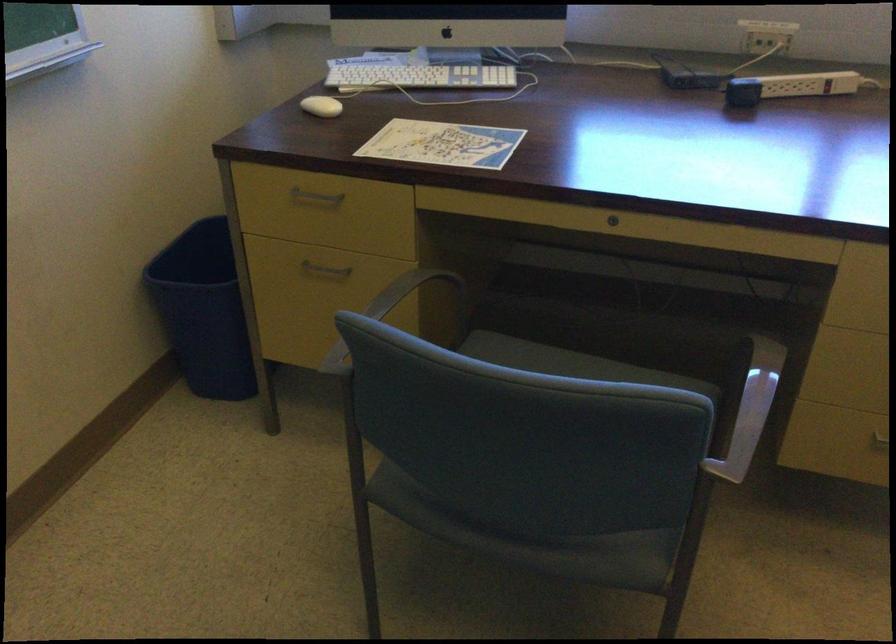
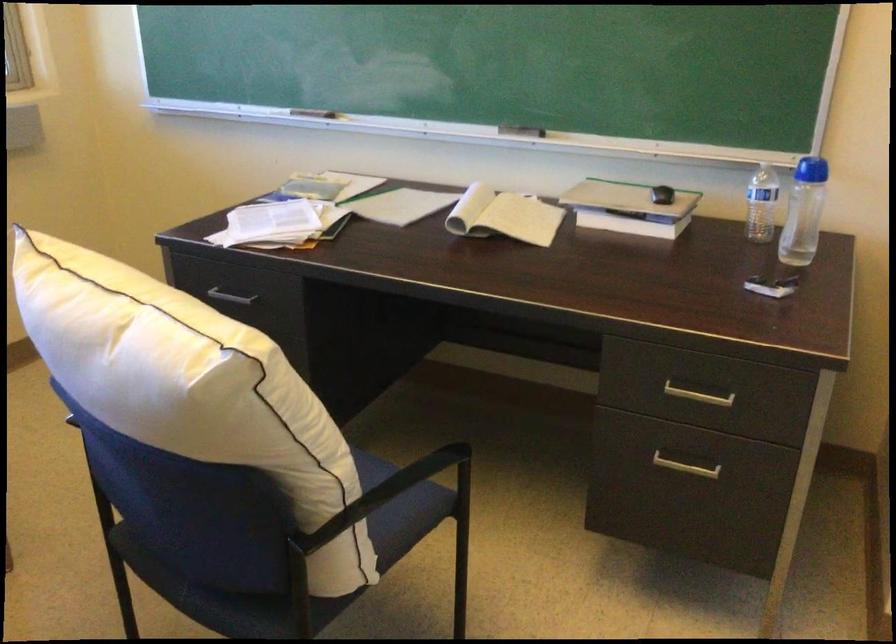
First-person continuous shooting, in which direction is the camera rotating?

The camera's rotation is toward right-down.